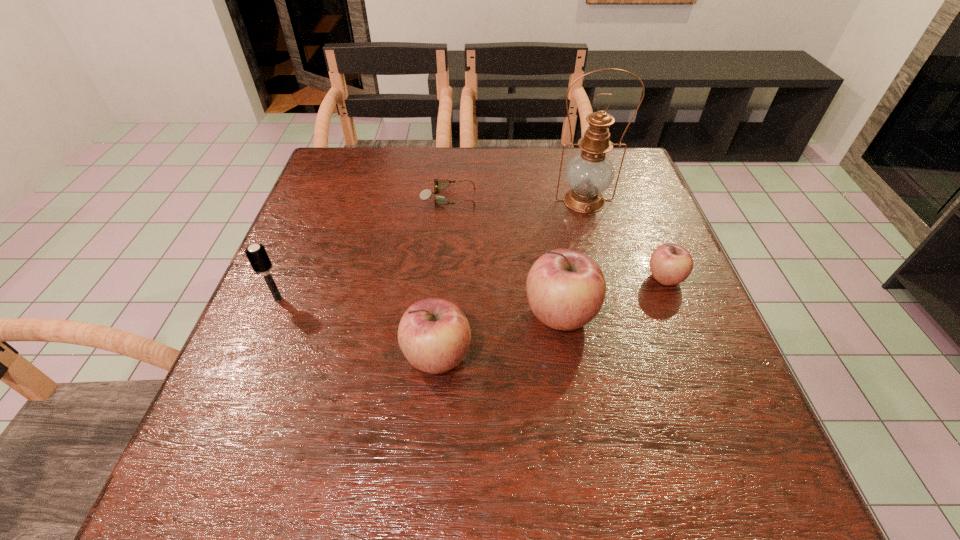
Where is `free space located on the front-facing side of the spectacles`? free space located on the front-facing side of the spectacles is located at coordinates (502, 198).

Find the location of a particular element. The height and width of the screenshot is (540, 960). free space located 0.300m on the back of the hairbrush is located at coordinates (317, 206).

What are the coordinates of `vacant space situated on the back of the oil lamp` in the screenshot? It's located at (575, 167).

The height and width of the screenshot is (540, 960). Identify the location of spectacles present at the far edge. (426, 193).

Where is `oil lamp located in the far edge section of the desktop`? oil lamp located in the far edge section of the desktop is located at coordinates (590, 173).

The width and height of the screenshot is (960, 540). Find the location of `object that is positioned at the near edge`. object that is positioned at the near edge is located at coordinates (434, 334).

The height and width of the screenshot is (540, 960). I want to click on object that is at the left edge, so click(256, 254).

Locate an element on the screen. apple at the right edge is located at coordinates (670, 264).

At what (x,y) coordinates should I click in order to perform the action: click on oil lamp at the right edge. Please return your answer as a coordinate pair (x, y). Image resolution: width=960 pixels, height=540 pixels. Looking at the image, I should click on (590, 173).

This screenshot has width=960, height=540. Find the location of `object present at the far right corner`. object present at the far right corner is located at coordinates (590, 173).